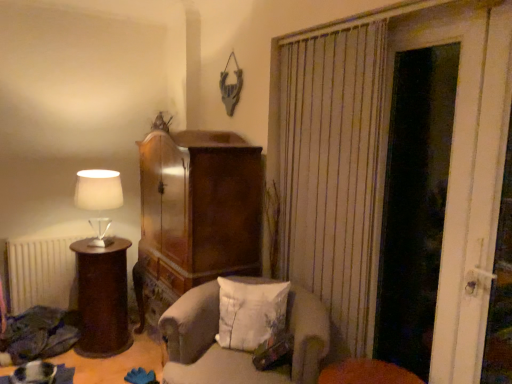
Question: Does light gray fabric chair at center come in front of white matte radiator at lower left?

Choices:
 (A) no
 (B) yes

Answer: (B)

Question: From the image's perspective, does light gray fabric chair at center appear higher than white matte radiator at lower left?

Choices:
 (A) no
 (B) yes

Answer: (A)

Question: Can you confirm if light gray fabric chair at center is positioned to the right of white matte radiator at lower left?

Choices:
 (A) no
 (B) yes

Answer: (B)

Question: Is light gray fabric chair at center further to the viewer compared to white matte radiator at lower left?

Choices:
 (A) yes
 (B) no

Answer: (B)

Question: From the image's perspective, would you say light gray fabric chair at center is shown under white matte radiator at lower left?

Choices:
 (A) yes
 (B) no

Answer: (A)

Question: Can you confirm if light gray fabric chair at center is shorter than white matte radiator at lower left?

Choices:
 (A) no
 (B) yes

Answer: (B)

Question: From the image's perspective, does white wooden door at right appear higher than white matte radiator at lower left?

Choices:
 (A) yes
 (B) no

Answer: (A)

Question: Is white wooden door at right further to camera compared to white matte radiator at lower left?

Choices:
 (A) no
 (B) yes

Answer: (A)

Question: Does white wooden door at right have a lesser width compared to white matte radiator at lower left?

Choices:
 (A) yes
 (B) no

Answer: (A)

Question: Does white wooden door at right appear on the left side of white matte radiator at lower left?

Choices:
 (A) no
 (B) yes

Answer: (A)

Question: Is white wooden door at right positioned far away from white matte radiator at lower left?

Choices:
 (A) no
 (B) yes

Answer: (B)

Question: Can you confirm if white wooden door at right is bigger than white matte radiator at lower left?

Choices:
 (A) no
 (B) yes

Answer: (A)

Question: From a real-world perspective, is wooden side table at left on top of matte white lampshade at left?

Choices:
 (A) no
 (B) yes

Answer: (A)